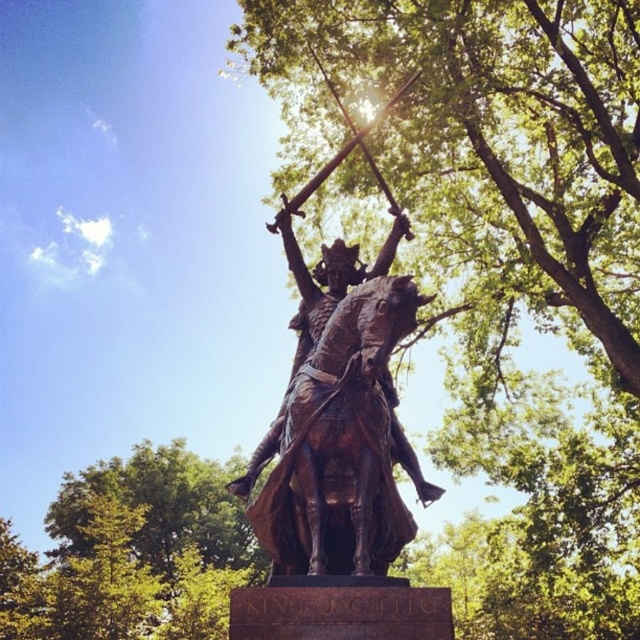
You are a photographer planning to take a photo of the bronze statue at center. You want to ensure the green leafy tree at upper center doesn not block the statue in the shot. Can you position yourself so that the tree is entirely above the statue in the frame?

The green leafy tree at upper center is taller than bronze statue at center, so positioning yourself to have the tree entirely above the statue in the frame may be challenging as the tree is taller and might still appear in the upper part of the frame. However, adjusting the angle or distance could help minimize overlap.